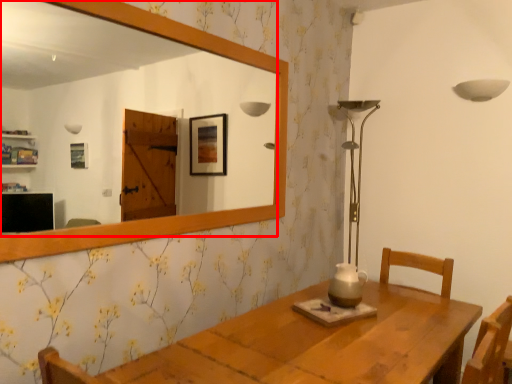
Question: Observing the image, what is the correct spatial positioning of mirror (annotated by the red box) in reference to candle holder?

Choices:
 (A) right
 (B) left

Answer: (B)